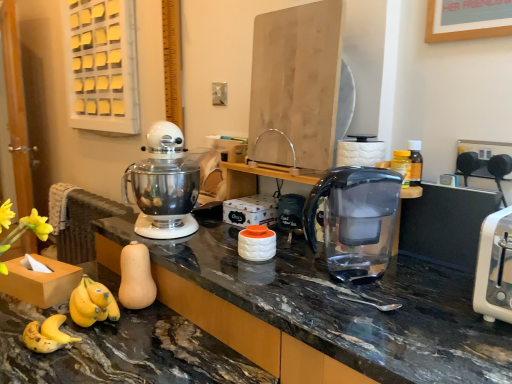
This screenshot has height=384, width=512. I want to click on satin silver mixer at center, so click(x=165, y=185).

Describe the element at coordinates (165, 185) in the screenshot. This screenshot has height=384, width=512. I see `satin silver mixer at center` at that location.

This screenshot has width=512, height=384. I want to click on marble black countertop at lower left, so click(323, 309).

The height and width of the screenshot is (384, 512). What are the coordinates of `matte black jar at center` in the screenshot? It's located at (290, 211).

Based on the photo, does marble black countertop at lower left lie behind white plastic toaster at right?

No.

Does point (259, 280) lie in front of point (508, 258)?

No, (259, 280) is behind (508, 258).

Would you say marble black countertop at lower left is a long distance from white plastic toaster at right?

They are positioned close to each other.

In the scene shown: Between satin silver mixer at center and transparent plastic water filter pitcher at center, which one has larger size?

Bigger between the two is satin silver mixer at center.

Is satin silver mixer at center far from transparent plastic water filter pitcher at center?

satin silver mixer at center is actually quite close to transparent plastic water filter pitcher at center.

Between satin silver mixer at center and transparent plastic water filter pitcher at center, which one is positioned in front?

Positioned in front is transparent plastic water filter pitcher at center.

From the image's perspective, relative to transparent plastic water filter pitcher at center, is satin silver mixer at center above or below?

satin silver mixer at center is situated higher than transparent plastic water filter pitcher at center in the image.

Between point (170, 264) and point (170, 217), which one is positioned behind?

The point (170, 217) is farther from the camera.

Which is in front, marble black countertop at lower left or satin silver mixer at center?

Positioned in front is marble black countertop at lower left.

In terms of height, does marble black countertop at lower left look taller or shorter compared to satin silver mixer at center?

Considering their sizes, marble black countertop at lower left has more height than satin silver mixer at center.

Choose the correct answer: Is marble black countertop at lower left inside satin silver mixer at center or outside it?

marble black countertop at lower left lies outside satin silver mixer at center.

Image resolution: width=512 pixels, height=384 pixels. Identify the location of coffeepot on the right of satin silver mixer at center. (355, 220).

From the image's perspective, is transparent plastic water filter pitcher at center on satin silver mixer at center?

No.

Can we say transparent plastic water filter pitcher at center lies outside marble black countertop at lower left?

Yes, transparent plastic water filter pitcher at center is not within marble black countertop at lower left.

From the image's perspective, which object appears higher, transparent plastic water filter pitcher at center or marble black countertop at lower left?

transparent plastic water filter pitcher at center, from the image's perspective.

Between transparent plastic water filter pitcher at center and marble black countertop at lower left, which one has more height?

marble black countertop at lower left.

From a real-world perspective, is white plastic toaster at right physically above matte black jar at center?

Indeed, from a real-world perspective, white plastic toaster at right stands above matte black jar at center.

In the image, is white plastic toaster at right positioned in front of or behind matte black jar at center?

white plastic toaster at right is positioned closer to the viewer than matte black jar at center.

Is white plastic toaster at right shorter than matte black jar at center?

No.

Is white plastic toaster at right surrounding matte black jar at center?

Definitely not — matte black jar at center is not inside white plastic toaster at right.

How many degrees apart are the facing directions of white plastic toaster at right and marble black countertop at lower left?

There is a 0.000825-degree angle between the facing directions of white plastic toaster at right and marble black countertop at lower left.

Is point (483, 236) more distant than point (442, 326)?

Yes, it is.

Would you consider white plastic toaster at right to be distant from marble black countertop at lower left?

No, white plastic toaster at right is not far away from marble black countertop at lower left.

At what (x,y) coordinates should I click in order to perform the action: click on countertop that appears below the white plastic toaster at right (from a real-world perspective). Please return your answer as a coordinate pair (x, y). The width and height of the screenshot is (512, 384). Looking at the image, I should click on (323, 309).

You are a GUI agent. You are given a task and a screenshot of the screen. Output one action in this format:
    pyautogui.click(x=<x>, y=<y>)
    Task: Click on the mixer above the transparent plastic water filter pitcher at center (from the image's perspective)
    Image resolution: width=512 pixels, height=384 pixels.
    Given the screenshot: What is the action you would take?
    click(165, 185)

When comparing their distances from marble black countertop at lower left, does transparent plastic water filter pitcher at center or matte black jar at center seem closer?

Based on the image, transparent plastic water filter pitcher at center appears to be nearer to marble black countertop at lower left.

When comparing their distances from transparent plastic water filter pitcher at center, does satin silver mixer at center or matte black jar at center seem closer?

The object closer to transparent plastic water filter pitcher at center is matte black jar at center.

Estimate the real-world distances between objects in this image. Which object is closer to transparent plastic water filter pitcher at center, marble black countertop at lower left or matte black jar at center?

Based on the image, marble black countertop at lower left appears to be nearer to transparent plastic water filter pitcher at center.

Considering their positions, is marble black countertop at lower left positioned further to matte black jar at center than transparent plastic water filter pitcher at center?

marble black countertop at lower left.

Considering their positions, is white plastic toaster at right positioned further to satin silver mixer at center than marble black countertop at lower left?

Among the two, white plastic toaster at right is located further to satin silver mixer at center.

Looking at the image, which one is located closer to white plastic toaster at right, satin silver mixer at center or transparent plastic water filter pitcher at center?

transparent plastic water filter pitcher at center is closer to white plastic toaster at right.

Estimate the real-world distances between objects in this image. Which object is further from matte black jar at center, white plastic toaster at right or satin silver mixer at center?

Among the two, white plastic toaster at right is located further to matte black jar at center.

Estimate the real-world distances between objects in this image. Which object is further from white plastic toaster at right, matte black jar at center or marble black countertop at lower left?

The object further to white plastic toaster at right is matte black jar at center.

The image size is (512, 384). I want to click on coffeepot between marble black countertop at lower left and white plastic toaster at right from left to right, so click(355, 220).

Locate an element on the screen. coffeepot between satin silver mixer at center and white plastic toaster at right in the horizontal direction is located at coordinates (355, 220).

I want to click on coffeepot between marble black countertop at lower left and satin silver mixer at center from front to back, so tap(355, 220).

Locate an element on the screen. This screenshot has height=384, width=512. countertop between satin silver mixer at center and white plastic toaster at right from left to right is located at coordinates (323, 309).